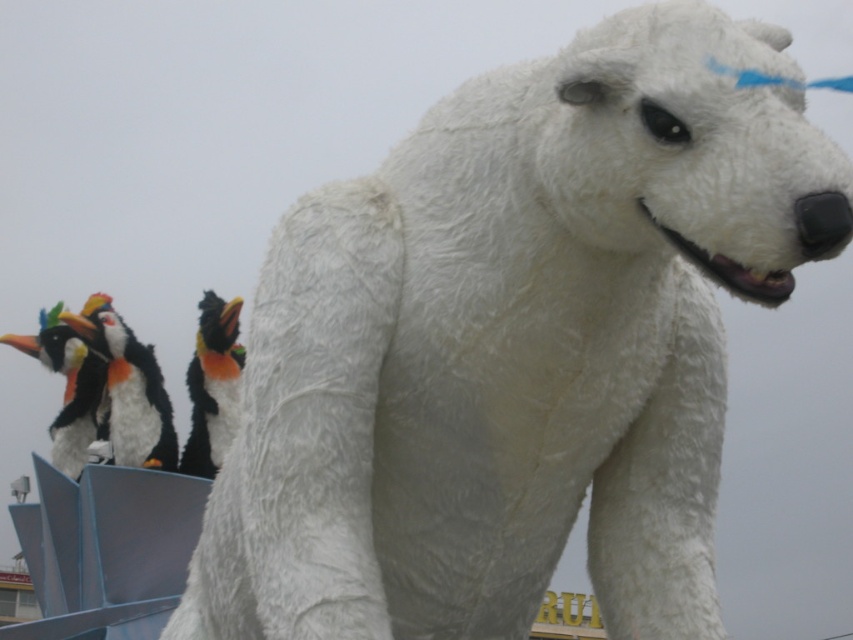
Question: Which object is positioned farthest from the black and orange feathers at left?

Choices:
 (A) black plush penguin at left
 (B) fluffy white penguin at left

Answer: (A)

Question: Does black and orange feathers at left have a greater width compared to black plush penguin at left?

Choices:
 (A) no
 (B) yes

Answer: (A)

Question: Based on their relative distances, which object is farther from the black plush penguin at left?

Choices:
 (A) black and orange feathers at left
 (B) fluffy white penguin at left

Answer: (A)

Question: Does fluffy white penguin at left appear under black and orange feathers at left?

Choices:
 (A) no
 (B) yes

Answer: (A)

Question: Which point is farther to the camera?

Choices:
 (A) black plush penguin at left
 (B) fluffy white penguin at left

Answer: (A)

Question: Does fluffy white penguin at left appear over black and orange feathers at left?

Choices:
 (A) no
 (B) yes

Answer: (B)